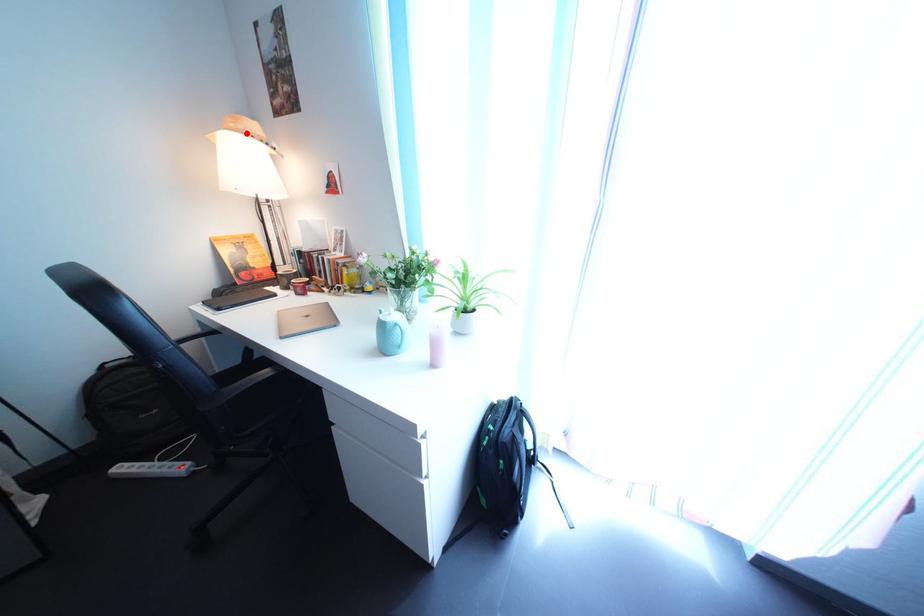
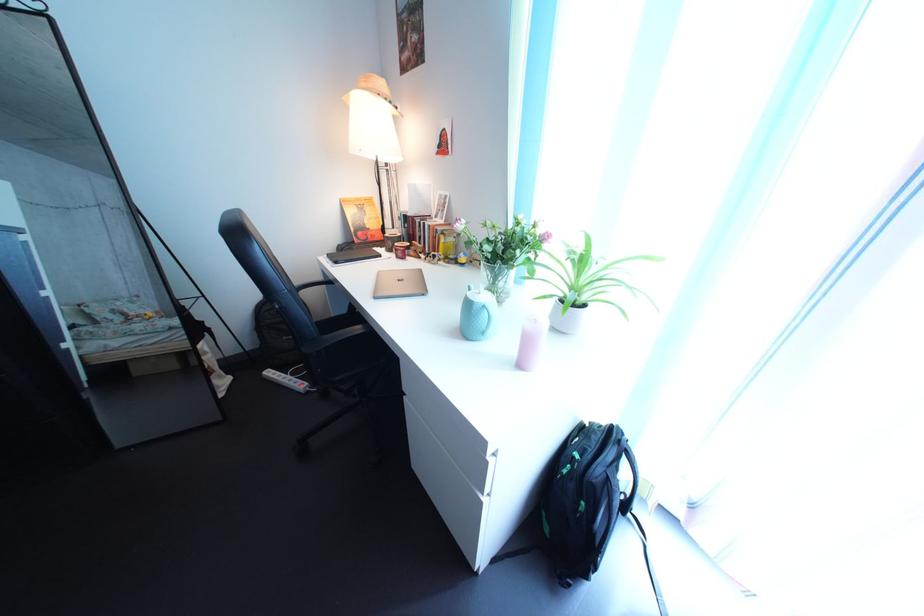
Find the pixel in the second image that matches the highlighted location in the first image.

(378, 92)